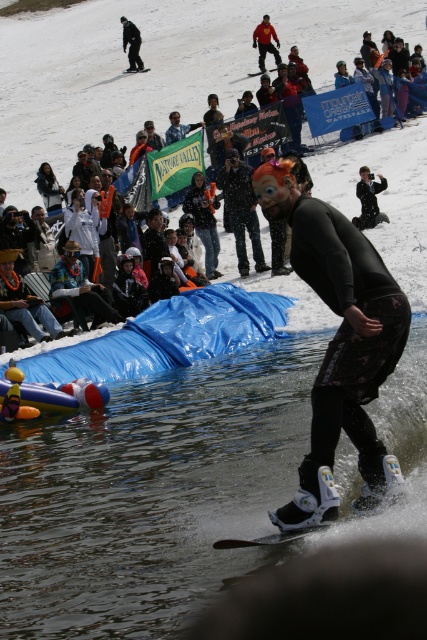
From the picture: Is matte black wetsuit at center taller than orange fabric mask at center?

Correct, matte black wetsuit at center is much taller as orange fabric mask at center.

Where is `matte black wetsuit at center`? This screenshot has width=427, height=640. matte black wetsuit at center is located at coordinates (157, 67).

What do you see at coordinates (151, 493) in the screenshot?
I see `clear plastic water at lower center` at bounding box center [151, 493].

Can you confirm if clear plastic water at lower center is positioned below orange fabric mask at center?

Indeed, clear plastic water at lower center is positioned under orange fabric mask at center.

Measure the distance between clear plastic water at lower center and camera.

clear plastic water at lower center is 10.22 meters away from camera.

Find the location of a particular element. The height and width of the screenshot is (640, 427). clear plastic water at lower center is located at coordinates (151, 493).

Is black matte jacket at center to the right of orange fabric mask at center from the viewer's perspective?

Indeed, black matte jacket at center is positioned on the right side of orange fabric mask at center.

Who is more forward, (228, 189) or (204, 212)?

Point (228, 189) is more forward.

Where is `black matte jacket at center`? black matte jacket at center is located at coordinates (240, 209).